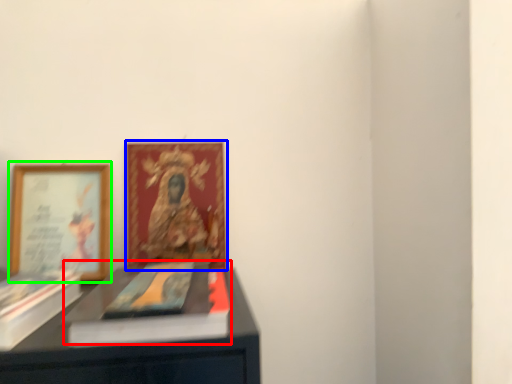
Question: Based on their relative distances, which object is nearer to book cover (highlighted by a red box)? Choose from picture frame (highlighted by a blue box) and picture frame (highlighted by a green box).

Choices:
 (A) picture frame
 (B) picture frame

Answer: (A)